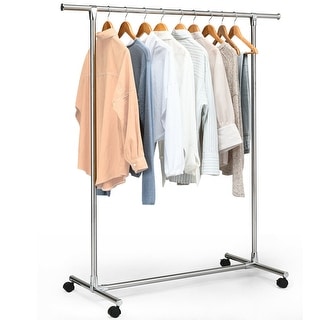
Find the location of a particular element. The height and width of the screenshot is (320, 320). caster wheels is located at coordinates (68, 285), (225, 262), (280, 283), (114, 314).